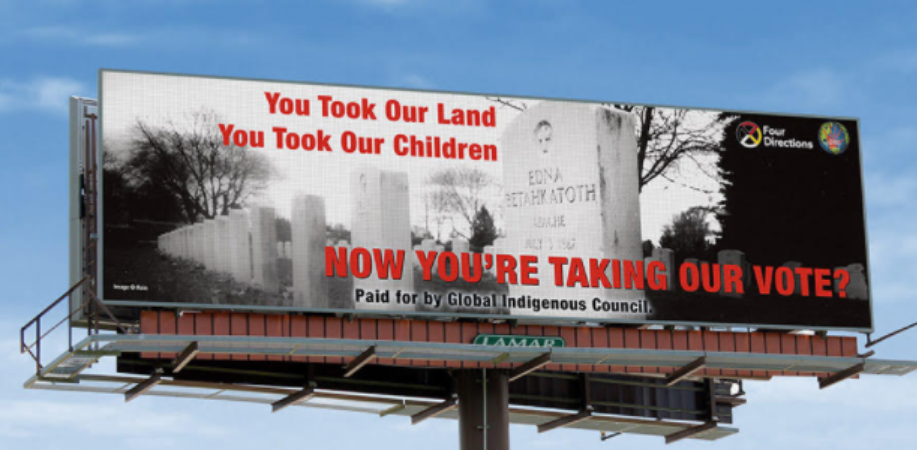
At what (x,y) coordinates should I click in order to perform the action: click on beams. Please return your answer as a coordinate pair (x, y). The image size is (917, 450). Looking at the image, I should click on (171, 370), (355, 367), (531, 370), (678, 375), (691, 434), (844, 378), (583, 414), (429, 412), (295, 402), (144, 386).